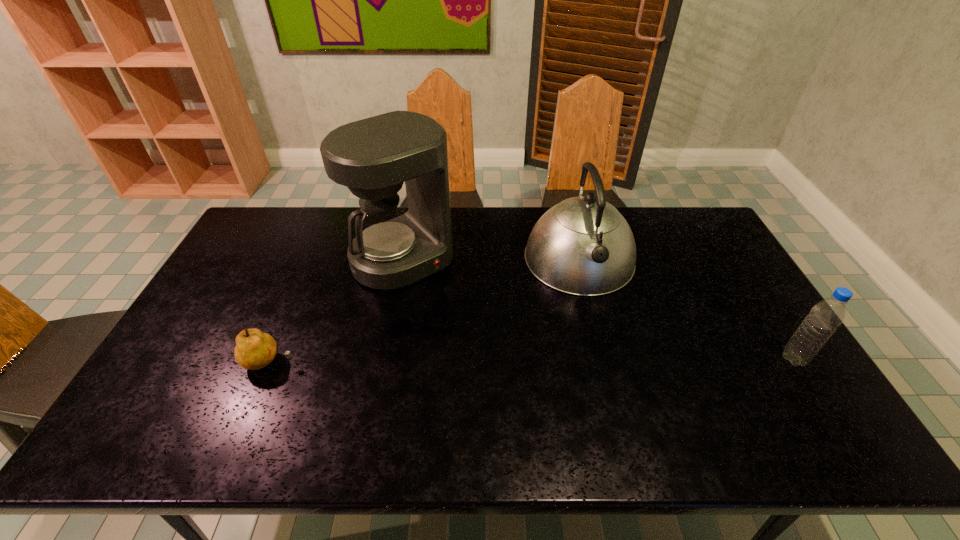
At what (x,y) coordinates should I click in order to perform the action: click on the leftmost object. Please return your answer as a coordinate pair (x, y). The height and width of the screenshot is (540, 960). Looking at the image, I should click on (254, 349).

Locate an element on the screen. pear is located at coordinates (254, 349).

This screenshot has width=960, height=540. Find the location of `the rightmost object`. the rightmost object is located at coordinates (823, 319).

Locate an element on the screen. Image resolution: width=960 pixels, height=540 pixels. the second shortest object is located at coordinates (823, 319).

You are a GUI agent. You are given a task and a screenshot of the screen. Output one action in this format:
    pyautogui.click(x=<x>, y=<y>)
    Task: Click on the third object from right to left
    Image resolution: width=960 pixels, height=540 pixels.
    Given the screenshot: What is the action you would take?
    pyautogui.click(x=394, y=247)

Identify the location of coffee maker. (394, 247).

Locate an element on the screen. Image resolution: width=960 pixels, height=540 pixels. the third object from left to right is located at coordinates (583, 246).

You are a GUI agent. You are given a task and a screenshot of the screen. Output one action in this format:
    pyautogui.click(x=<x>, y=<y>)
    Task: Click on the kettle
    This screenshot has width=960, height=540.
    Given the screenshot: What is the action you would take?
    pyautogui.click(x=583, y=246)

Where is `vacant space situated on the right of the shortest object`? The height and width of the screenshot is (540, 960). vacant space situated on the right of the shortest object is located at coordinates (323, 362).

The width and height of the screenshot is (960, 540). What are the coordinates of `free space located on the left of the rightmost object` in the screenshot? It's located at (725, 359).